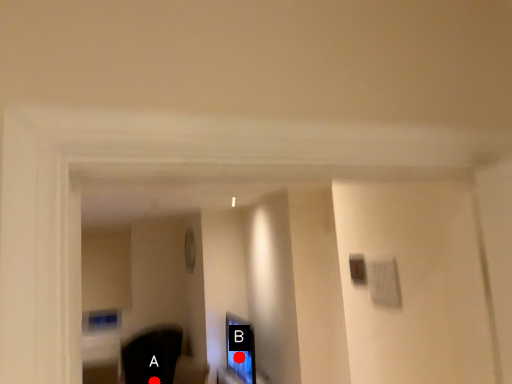
Question: Two points are circled on the image, labeled by A and B beside each circle. Which point appears farthest from the camera in this image?

Choices:
 (A) A is further
 (B) B is further

Answer: (A)